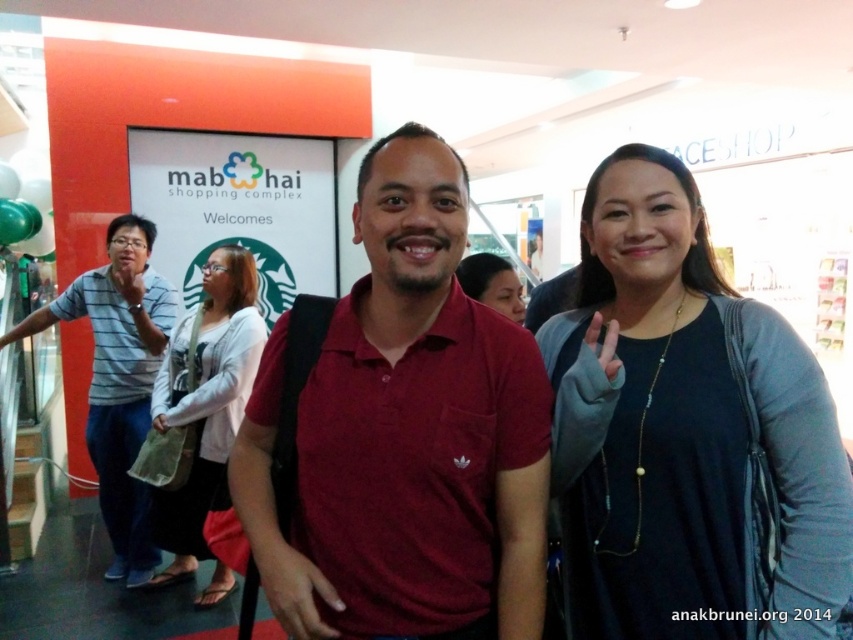
Can you confirm if black matte shirt at center is shorter than matte black hair at center?

Incorrect, black matte shirt at center's height does not fall short of matte black hair at center's.

Does point (699, 257) come behind point (479, 289)?

No.

Locate an element on the screen. The height and width of the screenshot is (640, 853). black matte shirt at center is located at coordinates (688, 433).

Is maroon cotton polo shirt at center to the right of striped cotton shirt at left from the viewer's perspective?

Correct, you'll find maroon cotton polo shirt at center to the right of striped cotton shirt at left.

Can you confirm if maroon cotton polo shirt at center is smaller than striped cotton shirt at left?

Yes, maroon cotton polo shirt at center is smaller than striped cotton shirt at left.

I want to click on maroon cotton polo shirt at center, so (x=405, y=435).

Locate an element on the screen. The image size is (853, 640). maroon cotton polo shirt at center is located at coordinates (405, 435).

Does black matte shirt at center have a greater height compared to striped cotton shirt at left?

No.

Is point (689, 474) farther from camera compared to point (113, 262)?

No, it is in front of (113, 262).

Where is `black matte shirt at center`? This screenshot has width=853, height=640. black matte shirt at center is located at coordinates (688, 433).